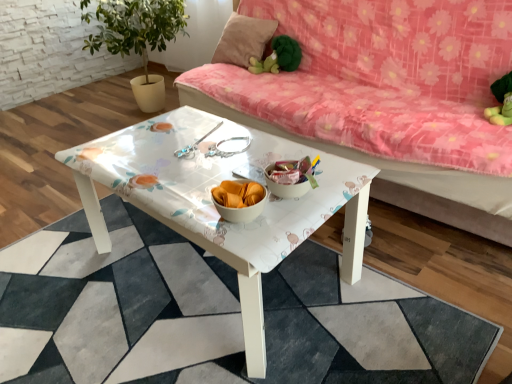
Question: Is floral fabric couch at upper center taller than white glossy coffee table at center?

Choices:
 (A) yes
 (B) no

Answer: (A)

Question: Is floral fabric couch at upper center further to the viewer compared to white glossy coffee table at center?

Choices:
 (A) no
 (B) yes

Answer: (B)

Question: Can you confirm if floral fabric couch at upper center is thinner than white glossy coffee table at center?

Choices:
 (A) yes
 (B) no

Answer: (A)

Question: From a real-world perspective, is floral fabric couch at upper center on top of white glossy coffee table at center?

Choices:
 (A) no
 (B) yes

Answer: (B)

Question: From the image's perspective, would you say floral fabric couch at upper center is positioned over white glossy coffee table at center?

Choices:
 (A) yes
 (B) no

Answer: (A)

Question: Is floral fabric couch at upper center positioned in front of white glossy coffee table at center?

Choices:
 (A) yes
 (B) no

Answer: (B)

Question: From a real-world perspective, is white glossy table at center physically below floral fabric couch at upper center?

Choices:
 (A) yes
 (B) no

Answer: (A)

Question: Is white glossy table at center not within floral fabric couch at upper center?

Choices:
 (A) no
 (B) yes

Answer: (B)

Question: Is the surface of white glossy table at center in direct contact with floral fabric couch at upper center?

Choices:
 (A) no
 (B) yes

Answer: (A)

Question: Is white glossy table at center at the right side of floral fabric couch at upper center?

Choices:
 (A) no
 (B) yes

Answer: (A)

Question: Is white glossy table at center closer to camera compared to floral fabric couch at upper center?

Choices:
 (A) no
 (B) yes

Answer: (B)

Question: Is white glossy table at center not near floral fabric couch at upper center?

Choices:
 (A) yes
 (B) no

Answer: (B)

Question: Would you say pink fabric pillow at upper center is a long distance from green plush toy at upper center?

Choices:
 (A) yes
 (B) no

Answer: (B)